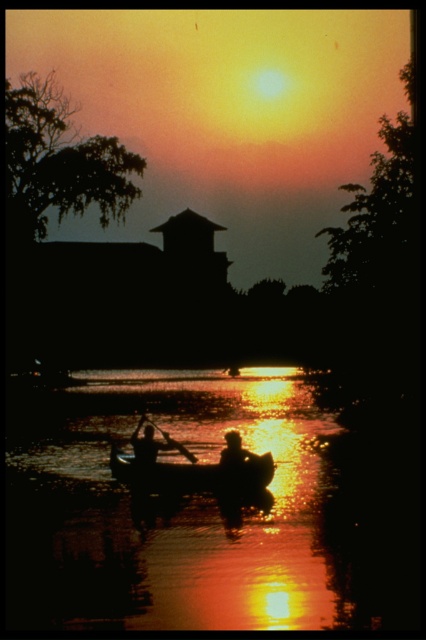
You are planning to place a 3.0 meter long wooden bench between the silhouette wood canoe at center and the silhouette human at center. Will there be enough space to fit the bench between them?

The silhouette wood canoe at center is 3.19 meters from the silhouette human at center. Since the bench is 3.0 meters long, there is enough space to fit it between them as the distance is slightly greater than the bench length.

You are a photographer trying to capture the sunset scene. You want to position your camera so that the silhouette wood canoe at center is centered in your shot. Given the coordinates provided, is the canoe already centered in the frame?

The silhouette wood canoe at center is located at point (192, 472), which may not be exactly at the center of the frame. To center it, you would need to adjust the camera position so the coordinates align with the frame center.